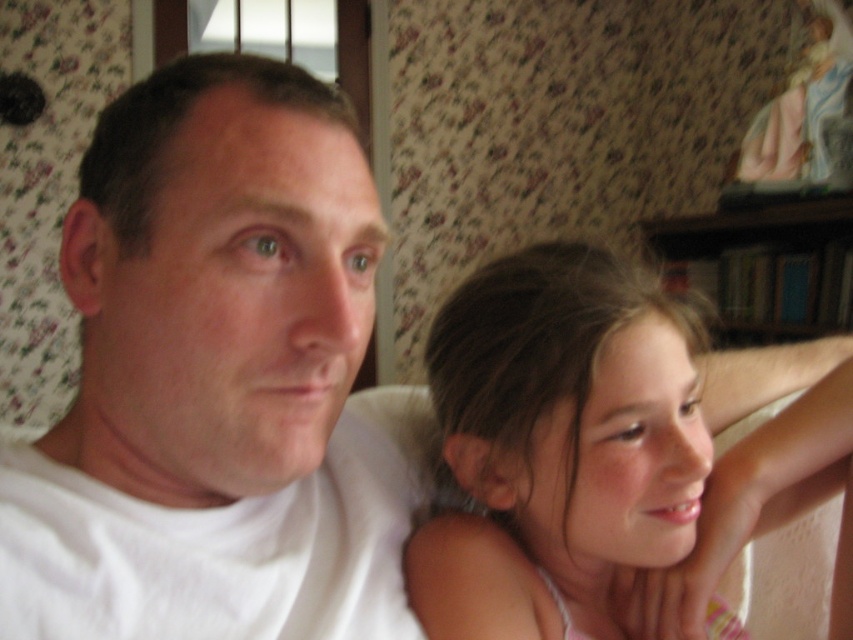
Between light brown hair at center and smooth skin face at center, which one is positioned higher?

light brown hair at center

Is point (646, 556) positioned in front of point (685, 616)?

That is True.

I want to click on light brown hair at center, so tap(556, 444).

Is white matte shirt at upper left positioned at the back of light brown hair at center?

No.

Measure the distance between white matte shirt at upper left and camera.

white matte shirt at upper left and camera are 16.36 inches apart from each other.

Locate an element on the screen. The width and height of the screenshot is (853, 640). white matte shirt at upper left is located at coordinates (213, 380).

Is white matte shirt at upper left positioned in front of smooth skin face at center?

Yes.

Can you confirm if white matte shirt at upper left is bigger than smooth skin face at center?

Correct, white matte shirt at upper left is larger in size than smooth skin face at center.

Is point (206, 557) farther from viewer compared to point (728, 484)?

No, (206, 557) is closer to viewer.

Locate an element on the screen. The height and width of the screenshot is (640, 853). white matte shirt at upper left is located at coordinates (213, 380).